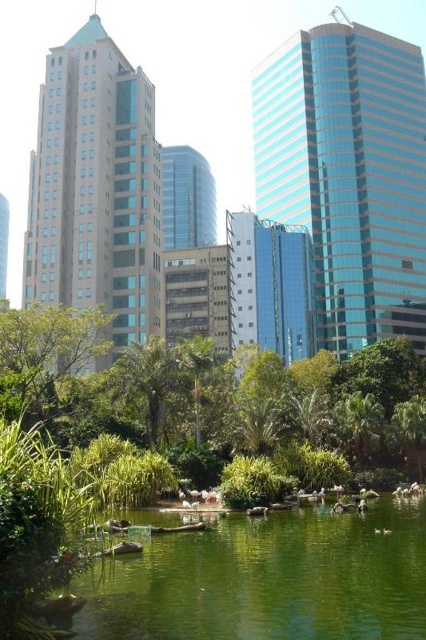
You are standing at the center of the pond and want to take a photo of the beige glass tower at left. Which direction should you face to capture it in your view?

The beige glass tower at left is located at point (95, 188), so you should face towards the left side to capture it in your view.

You are standing in a park and want to take a photo of both the green glossy lake at center and the shiny glass tower at center. Which object should you focus on first to ensure both are in the frame?

You should focus on the green glossy lake at center first because it is closer to you than the shiny glass tower at center, so adjusting the camera to include both would require starting with the closer object.